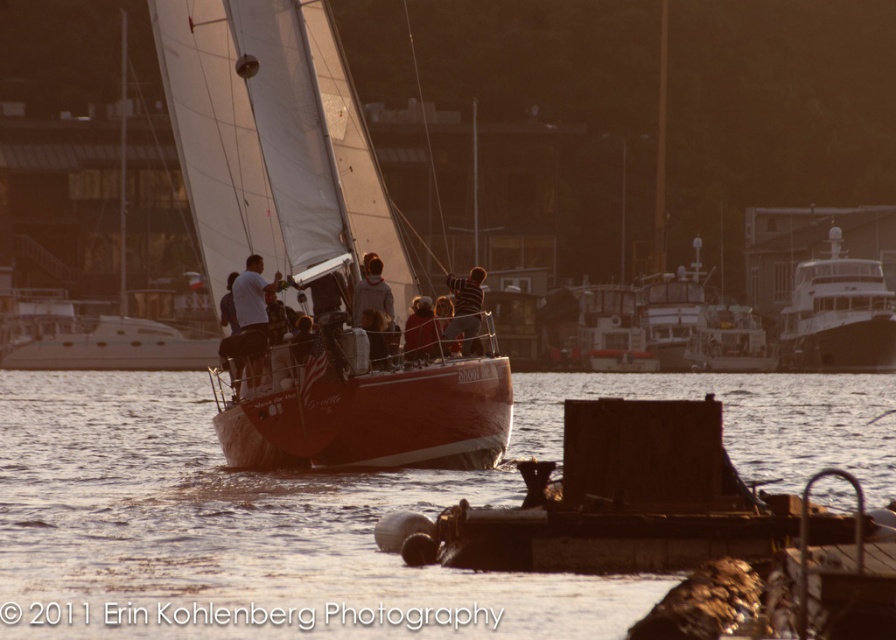
Does translucent water at lower center have a lesser height compared to white glossy boat at center?

Indeed, translucent water at lower center has a lesser height compared to white glossy boat at center.

Describe the element at coordinates (237, 528) in the screenshot. I see `translucent water at lower center` at that location.

Where is `translucent water at lower center`? The height and width of the screenshot is (640, 896). translucent water at lower center is located at coordinates (237, 528).

Is rustic wood dock at lower center behind white matte shirt at center?

That is False.

Can you confirm if rustic wood dock at lower center is taller than white matte shirt at center?

Yes.

What do you see at coordinates (612, 500) in the screenshot? The image size is (896, 640). I see `rustic wood dock at lower center` at bounding box center [612, 500].

Where is `rustic wood dock at lower center`? Image resolution: width=896 pixels, height=640 pixels. rustic wood dock at lower center is located at coordinates (612, 500).

Is point (823, 269) positioned before point (692, 321)?

No, (823, 269) is behind (692, 321).

Measure the distance from shiny silver yacht at right to white glossy boat at center.

shiny silver yacht at right is 36.08 feet from white glossy boat at center.

The height and width of the screenshot is (640, 896). Identify the location of shiny silver yacht at right. (837, 316).